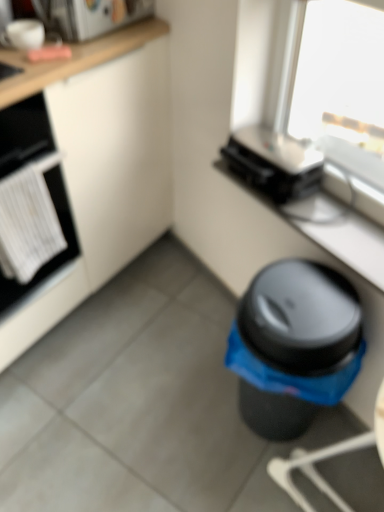
Measure the distance between point (279,271) and camera.

Point (279,271) is 3.72 feet from camera.

You are a GUI agent. You are given a task and a screenshot of the screen. Output one action in this format:
    pyautogui.click(x=<x>, y=<y>)
    Task: Click on the black plastic waste bin at lower right
    The height and width of the screenshot is (512, 384).
    Given the screenshot: What is the action you would take?
    pyautogui.click(x=294, y=346)

Based on the photo, what is the approximate height of white glossy microwave at upper left, positioned as the first appliance in top-to-bottom order?

12.81 centimeters.

Measure the distance between white glossy microwave at upper left, which is the first appliance in left-to-right order, and camera.

A distance of 4.18 feet exists between white glossy microwave at upper left, which is the first appliance in left-to-right order, and camera.

Identify the location of matte black toaster at upper right. The image size is (384, 512). (338, 230).

The width and height of the screenshot is (384, 512). What do you see at coordinates (99, 163) in the screenshot?
I see `white matte cabinet at lower left` at bounding box center [99, 163].

Locate an element on the screen. black plastic toaster at upper center, arranged as the first appliance when ordered from the bottom is located at coordinates (274, 162).

I want to click on black plastic waste bin at lower right, so click(x=294, y=346).

Considering the relative sizes of white glossy microwave at upper left, positioned as the first appliance in top-to-bottom order, and black plastic waste bin at lower right in the image provided, is white glossy microwave at upper left, positioned as the first appliance in top-to-bottom order, bigger than black plastic waste bin at lower right?

Incorrect, white glossy microwave at upper left, positioned as the first appliance in top-to-bottom order, is not larger than black plastic waste bin at lower right.

Does point (75, 39) appear closer or farther from the camera than point (346, 296)?

Point (75, 39).

Can you confirm if white glossy microwave at upper left, which is the second appliance from right to left, is shorter than black plastic waste bin at lower right?

Yes, white glossy microwave at upper left, which is the second appliance from right to left, is shorter than black plastic waste bin at lower right.

How different are the orientations of white glossy microwave at upper left, which ranks as the 2th appliance in bottom-to-top order, and black plastic waste bin at lower right in degrees?

22.3 degrees separate the facing orientations of white glossy microwave at upper left, which ranks as the 2th appliance in bottom-to-top order, and black plastic waste bin at lower right.

In the image, is white glossy microwave at upper left, which is the first appliance in left-to-right order, on the left side or the right side of white matte cabinet at lower left?

From the image, it's evident that white glossy microwave at upper left, which is the first appliance in left-to-right order, is to the right of white matte cabinet at lower left.

Is point (52, 21) closer or farther from the camera than point (166, 173)?

Point (52, 21) is positioned closer to the camera compared to point (166, 173).

From a real-world perspective, is white glossy microwave at upper left, which is the second appliance from right to left, above or below white matte cabinet at lower left?

Clearly, from a real-world perspective, white glossy microwave at upper left, which is the second appliance from right to left, is above white matte cabinet at lower left.

Could you measure the distance between white glossy microwave at upper left, which is the first appliance in left-to-right order, and white matte cabinet at lower left?

white glossy microwave at upper left, which is the first appliance in left-to-right order, and white matte cabinet at lower left are 14.13 inches apart.

From the image's perspective, which one is positioned higher, black plastic waste bin at lower right or white matte cabinet at lower left?

white matte cabinet at lower left appears higher in the image.

From a real-world perspective, is black plastic waste bin at lower right over white matte cabinet at lower left?

Incorrect, from a real-world perspective, black plastic waste bin at lower right is lower than white matte cabinet at lower left.

Who is more distant, black plastic waste bin at lower right or white matte cabinet at lower left?

Positioned behind is black plastic waste bin at lower right.

This screenshot has width=384, height=512. What are the coordinates of `cabinetry above the black plastic waste bin at lower right (from a real-world perspective)` in the screenshot? It's located at (99, 163).

Which point is more distant from viewer, (149, 223) or (278, 162)?

The point (149, 223) is behind.

From a real-world perspective, is white matte cabinet at lower left over black plastic toaster at upper center, acting as the 1th appliance starting from the right?

No, from a real-world perspective, white matte cabinet at lower left is not over black plastic toaster at upper center, acting as the 1th appliance starting from the right

Does white matte cabinet at lower left appear on the right side of black plastic toaster at upper center, acting as the 1th appliance starting from the right?

No, white matte cabinet at lower left is not to the right of black plastic toaster at upper center, acting as the 1th appliance starting from the right.

Between white matte cabinet at lower left and black plastic toaster at upper center, arranged as the first appliance when ordered from the bottom, which one is positioned behind?

Positioned behind is black plastic toaster at upper center, arranged as the first appliance when ordered from the bottom.

Does point (56, 199) appear closer or farther from the camera than point (105, 131)?

Point (56, 199) is closer to the camera than point (105, 131).

From a real-world perspective, between white matte oven at left and white matte cabinet at lower left, who is vertically higher?

white matte oven at left is physically above.

Between white matte oven at left and white matte cabinet at lower left, which one has larger size?

white matte cabinet at lower left.

In the scene shown: Is white matte oven at left facing away from white matte cabinet at lower left?

Yes, white matte cabinet at lower left is at the back of white matte oven at left.

Is white matte cabinet at lower left bigger or smaller than white matte oven at left?

white matte cabinet at lower left is bigger than white matte oven at left.

Is white matte cabinet at lower left next to white matte oven at left?

white matte cabinet at lower left is not next to white matte oven at left, and they're not touching.

Is point (89, 273) positioned behind point (38, 145)?

Yes, it is.

Is the depth of white matte cabinet at lower left less than that of white matte oven at left?

Yes.

Is matte black toaster at upper right beside black plastic toaster at upper center, arranged as the first appliance when ordered from the bottom?

No, matte black toaster at upper right is not touching black plastic toaster at upper center, arranged as the first appliance when ordered from the bottom.

Considering the relative positions of matte black toaster at upper right and black plastic toaster at upper center, which ranks as the 2th appliance in left-to-right order, in the image provided, is matte black toaster at upper right to the right of black plastic toaster at upper center, which ranks as the 2th appliance in left-to-right order, from the viewer's perspective?

Correct, you'll find matte black toaster at upper right to the right of black plastic toaster at upper center, which ranks as the 2th appliance in left-to-right order.

Considering their positions, is matte black toaster at upper right located in front of or behind black plastic toaster at upper center, acting as the 1th appliance starting from the right?

Clearly, matte black toaster at upper right is in front of black plastic toaster at upper center, acting as the 1th appliance starting from the right.

You are a GUI agent. You are given a task and a screenshot of the screen. Output one action in this format:
    pyautogui.click(x=<x>, y=<y>)
    Task: Click on the waste container in front of the white glossy microwave at upper left, which is the first appliance in left-to-right order
    The height and width of the screenshot is (512, 384).
    Given the screenshot: What is the action you would take?
    pyautogui.click(x=294, y=346)

This screenshot has height=512, width=384. In order to click on appliance that is above the white matte cabinet at lower left (from the image's perspective) in this screenshot , I will do `click(90, 16)`.

Estimate the real-world distances between objects in this image. Which object is closer to black plastic waste bin at lower right, black plastic toaster at upper center, arranged as the first appliance when ordered from the bottom, or white matte oven at left?

black plastic toaster at upper center, arranged as the first appliance when ordered from the bottom, lies closer to black plastic waste bin at lower right than the other object.

Looking at this image, based on their spatial positions, is matte black toaster at upper right or black plastic toaster at upper center, acting as the 1th appliance starting from the right, closer to black plastic waste bin at lower right?

matte black toaster at upper right lies closer to black plastic waste bin at lower right than the other object.

Looking at this image, when comparing their distances from matte black toaster at upper right, does black plastic waste bin at lower right or black plastic toaster at upper center, acting as the 1th appliance starting from the right, seem closer?

Based on the image, black plastic toaster at upper center, acting as the 1th appliance starting from the right, appears to be nearer to matte black toaster at upper right.

When comparing their distances from black plastic waste bin at lower right, does matte black toaster at upper right or white glossy microwave at upper left, positioned as the first appliance in top-to-bottom order, seem closer?

Among the two, matte black toaster at upper right is located nearer to black plastic waste bin at lower right.

Looking at the image, which one is located closer to matte black toaster at upper right, black plastic waste bin at lower right or white matte cabinet at lower left?

black plastic waste bin at lower right lies closer to matte black toaster at upper right than the other object.

Estimate the real-world distances between objects in this image. Which object is further from white matte cabinet at lower left, black plastic toaster at upper center, acting as the 1th appliance starting from the right, or white matte oven at left?

black plastic toaster at upper center, acting as the 1th appliance starting from the right.

Looking at the image, which one is located further to black plastic toaster at upper center, arranged as the first appliance when ordered from the bottom, black plastic waste bin at lower right or white matte oven at left?

Based on the image, white matte oven at left appears to be further to black plastic toaster at upper center, arranged as the first appliance when ordered from the bottom.

When comparing their distances from white matte cabinet at lower left, does white matte oven at left or black plastic toaster at upper center, acting as the 1th appliance starting from the right, seem further?

Based on the image, black plastic toaster at upper center, acting as the 1th appliance starting from the right, appears to be further to white matte cabinet at lower left.

At what (x,y) coordinates should I click in order to perform the action: click on counter top between black plastic toaster at upper center, which is counted as the second appliance, starting from the top, and black plastic waste bin at lower right, in the vertical direction. Please return your answer as a coordinate pair (x, y). The height and width of the screenshot is (512, 384). Looking at the image, I should click on click(338, 230).

Find the location of a particular element. appliance between white glossy microwave at upper left, positioned as the first appliance in top-to-bottom order, and matte black toaster at upper right is located at coordinates (274, 162).

At what (x,y) coordinates should I click in order to perform the action: click on appliance between white matte oven at left and black plastic toaster at upper center, arranged as the first appliance when ordered from the bottom, from left to right. Please return your answer as a coordinate pair (x, y). Looking at the image, I should click on (90, 16).

Locate an element on the screen. Image resolution: width=384 pixels, height=512 pixels. cabinetry between white matte oven at left and black plastic toaster at upper center, arranged as the first appliance when ordered from the bottom is located at coordinates (99, 163).